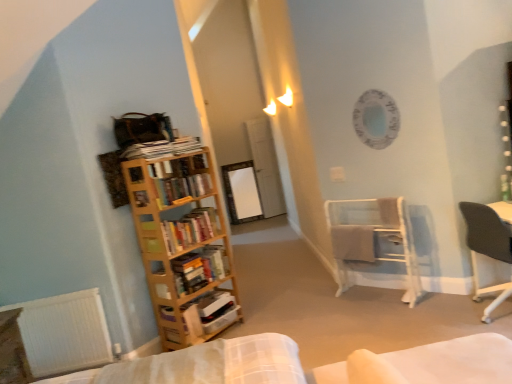
Where is `free space in front of white metal towel rack at center right`? This screenshot has width=512, height=384. free space in front of white metal towel rack at center right is located at coordinates (391, 327).